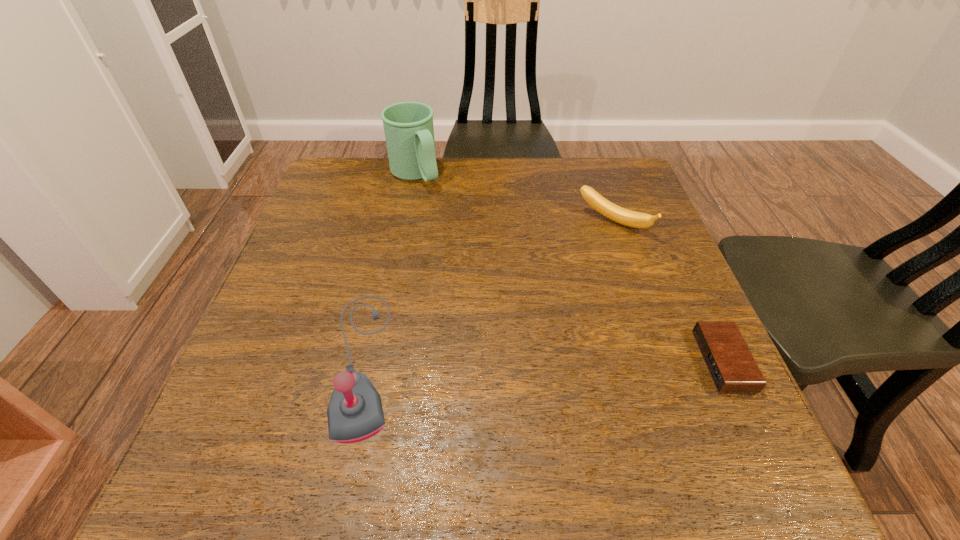
Where is `free space between the joystick and the second shortest object`? free space between the joystick and the second shortest object is located at coordinates (489, 292).

Where is `vacant area that lies between the farthest object and the third shortest object`? The image size is (960, 540). vacant area that lies between the farthest object and the third shortest object is located at coordinates (389, 268).

Locate an element on the screen. free space between the third nearest object and the alarm clock is located at coordinates (668, 292).

I want to click on blank region between the farthest object and the second farthest object, so [x=514, y=199].

I want to click on free spot between the third shortest object and the shortest object, so click(x=543, y=361).

The height and width of the screenshot is (540, 960). In order to click on unoccupied position between the joystick and the second shortest object in this screenshot , I will do `click(489, 292)`.

The image size is (960, 540). In order to click on free space between the shortest object and the mug in this screenshot , I will do `click(569, 268)`.

Locate an element on the screen. The height and width of the screenshot is (540, 960). free space between the alarm clock and the mug is located at coordinates (569, 268).

Locate an element on the screen. The width and height of the screenshot is (960, 540). the second closest object relative to the third shortest object is located at coordinates (623, 216).

Locate which object is the third closest to the mug. Please provide its 2D coordinates. Your answer should be formatted as a tuple, i.e. [(x, y)], where the tuple contains the x and y coordinates of a point satisfying the conditions above.

[(729, 361)]